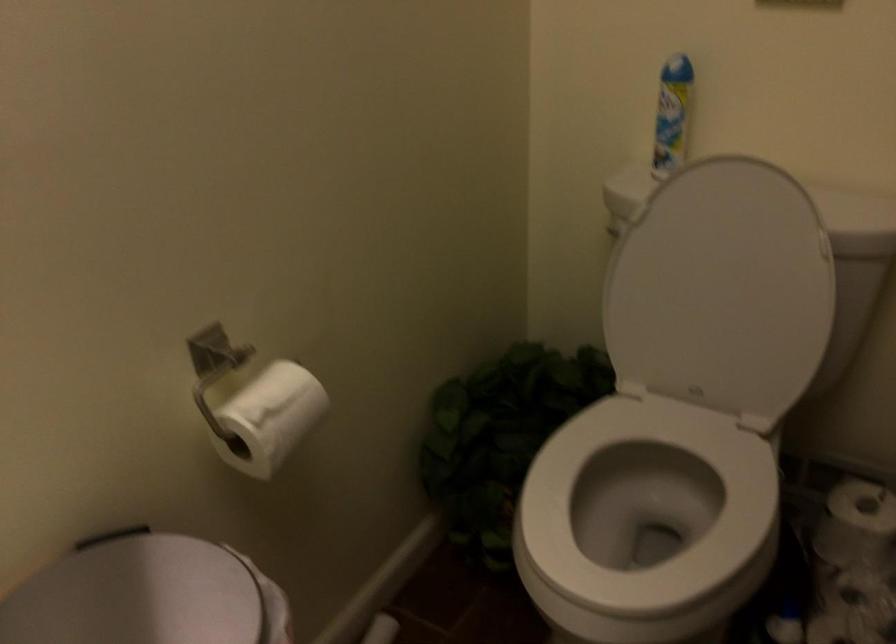
The width and height of the screenshot is (896, 644). What do you see at coordinates (138, 594) in the screenshot?
I see `the silver trash can lid` at bounding box center [138, 594].